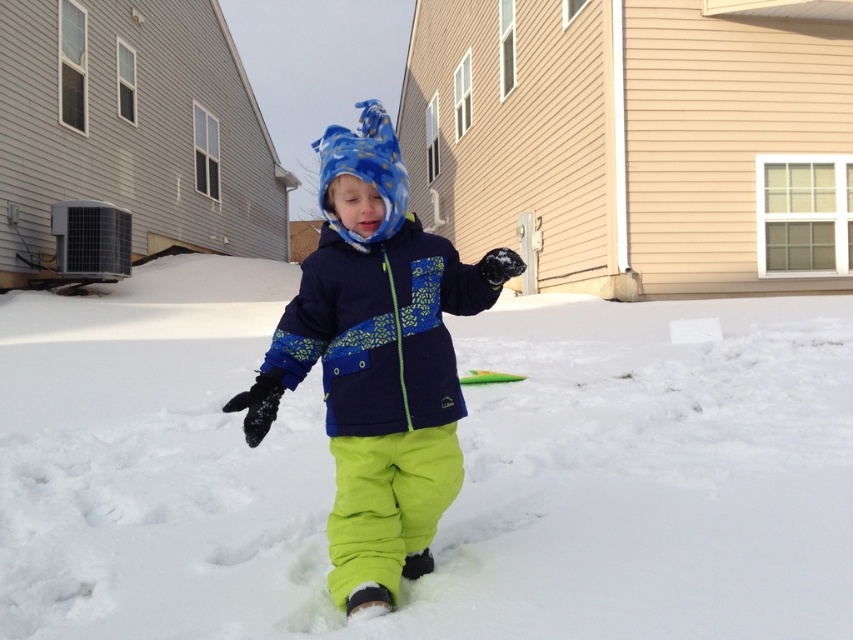
Question: Does white fluffy snow at center lie behind matte blue snowsuit at center?

Choices:
 (A) yes
 (B) no

Answer: (A)

Question: Considering the relative positions of matte blue snowsuit at center and navy blue fleece jacket at center in the image provided, where is matte blue snowsuit at center located with respect to navy blue fleece jacket at center?

Choices:
 (A) right
 (B) left

Answer: (B)

Question: Which of the following is the farthest from the observer?

Choices:
 (A) navy blue fleece jacket at center
 (B) white fluffy snow at center
 (C) matte blue snowsuit at center

Answer: (A)

Question: Which point is closer to the camera taking this photo?

Choices:
 (A) (544, 563)
 (B) (370, 333)

Answer: (B)

Question: In this image, where is white fluffy snow at center located relative to matte blue snowsuit at center?

Choices:
 (A) above
 (B) below

Answer: (B)

Question: Which point appears closest to the camera in this image?

Choices:
 (A) (393, 486)
 (B) (355, 417)

Answer: (B)